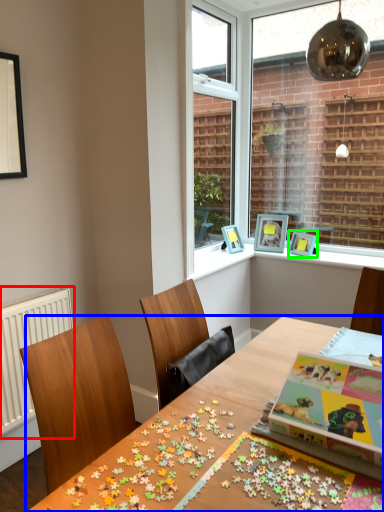
Question: Estimate the real-world distances between objects in this image. Which object is closer to radiator (highlighted by a red box), table (highlighted by a blue box) or picture frame (highlighted by a green box)?

Choices:
 (A) table
 (B) picture frame

Answer: (A)